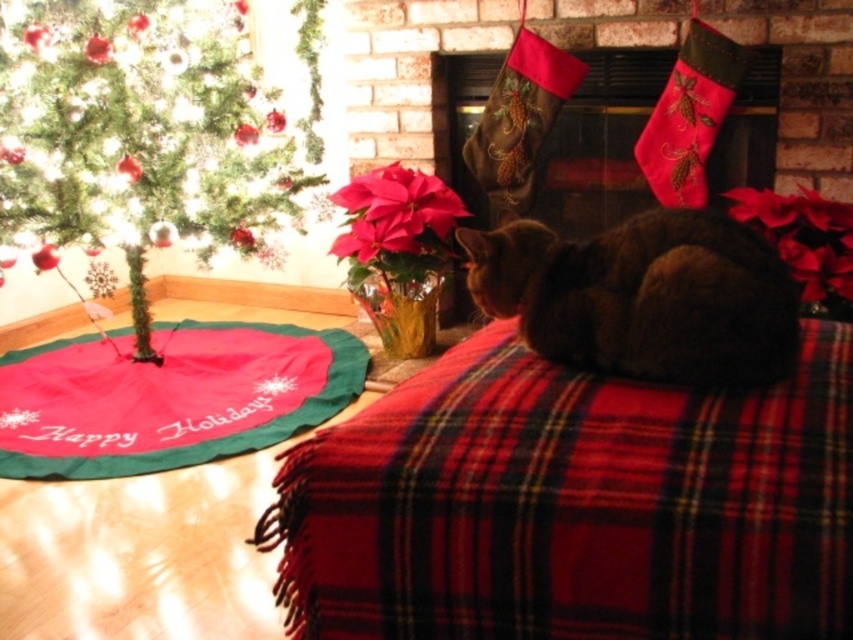
Question: Which point is closer to the camera taking this photo?

Choices:
 (A) (13, 355)
 (B) (526, 243)
 (C) (485, 216)

Answer: (B)

Question: Is red plaid blanket at center bigger than red plaid blanket at lower left?

Choices:
 (A) yes
 (B) no

Answer: (B)

Question: Is red plaid blanket at center smaller than velvet green stockings at center?

Choices:
 (A) yes
 (B) no

Answer: (A)

Question: Is red plaid blanket at center below brown fur cat at center?

Choices:
 (A) yes
 (B) no

Answer: (A)

Question: Which point appears farthest from the camera in this image?

Choices:
 (A) (86, 150)
 (B) (556, 131)
 (C) (287, 381)

Answer: (B)

Question: Which is farther from the red plaid blanket at lower left?

Choices:
 (A) green matte christmas tree at lower left
 (B) velvet green stockings at center
 (C) red plaid blanket at center

Answer: (C)